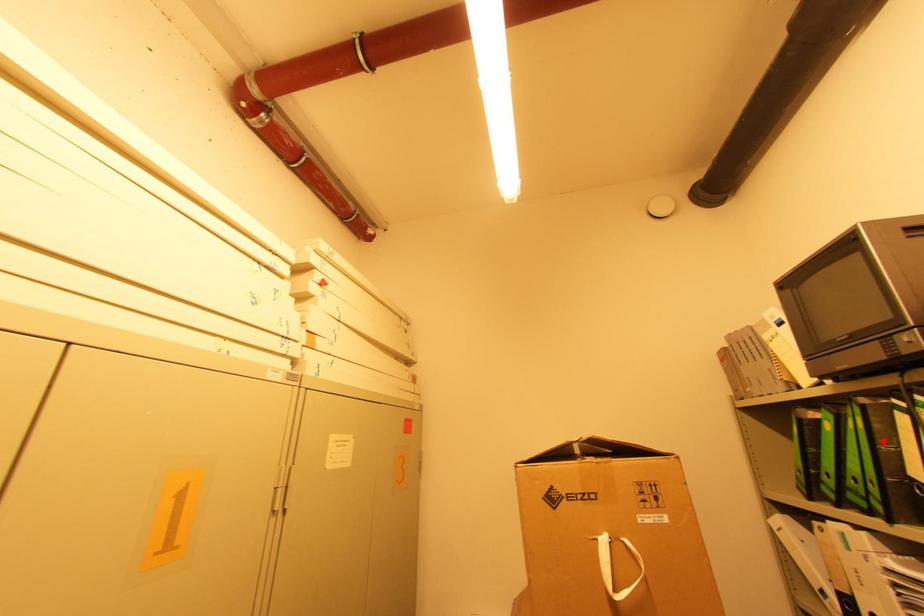
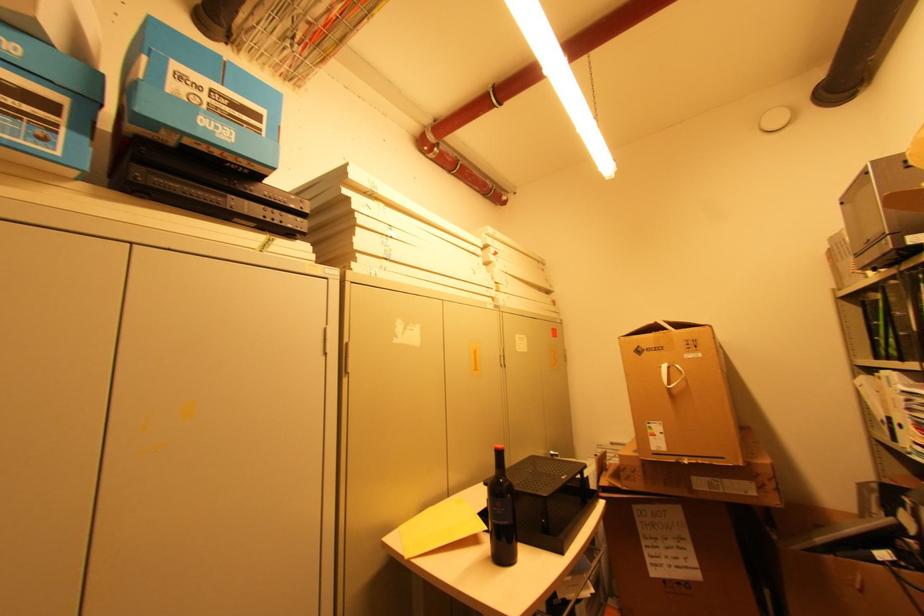
In the second image, find the point that corresponds to the highlighted location in the first image.

(896, 310)